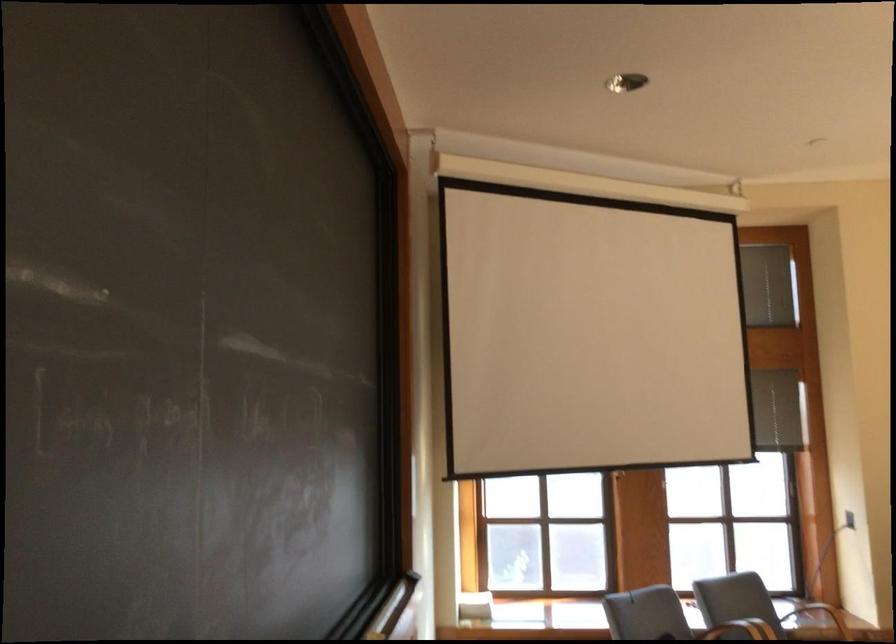
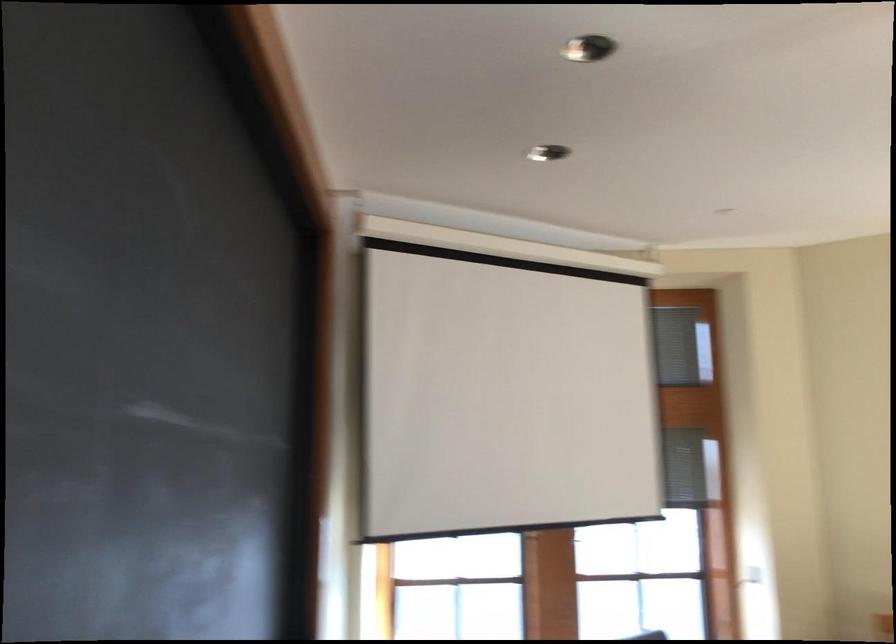
Question: What movement of the cameraman would produce the second image?

Choices:
 (A) Left
 (B) Right
 (C) Forward
 (D) Backward

Answer: (D)